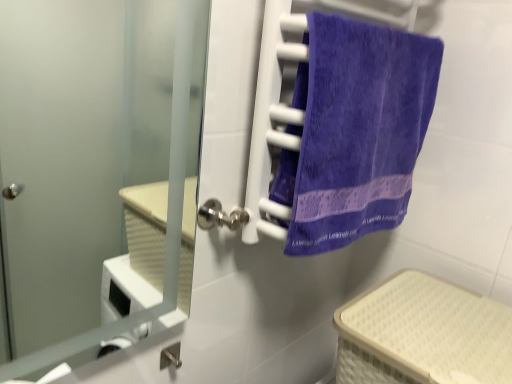
Question: Considering the positions of satin silver door at center and purple terry cloth towel at right in the image, is satin silver door at center taller or shorter than purple terry cloth towel at right?

Choices:
 (A) tall
 (B) short

Answer: (A)

Question: From the image's perspective, is satin silver door at center above or below purple terry cloth towel at right?

Choices:
 (A) above
 (B) below

Answer: (B)

Question: Which of these objects is positioned farthest from the beige woven basket at lower right?

Choices:
 (A) satin silver door at center
 (B) purple terry cloth towel at right

Answer: (A)

Question: Which object is the closest to the purple terry cloth towel at right?

Choices:
 (A) satin silver door at center
 (B) beige woven basket at lower right

Answer: (B)